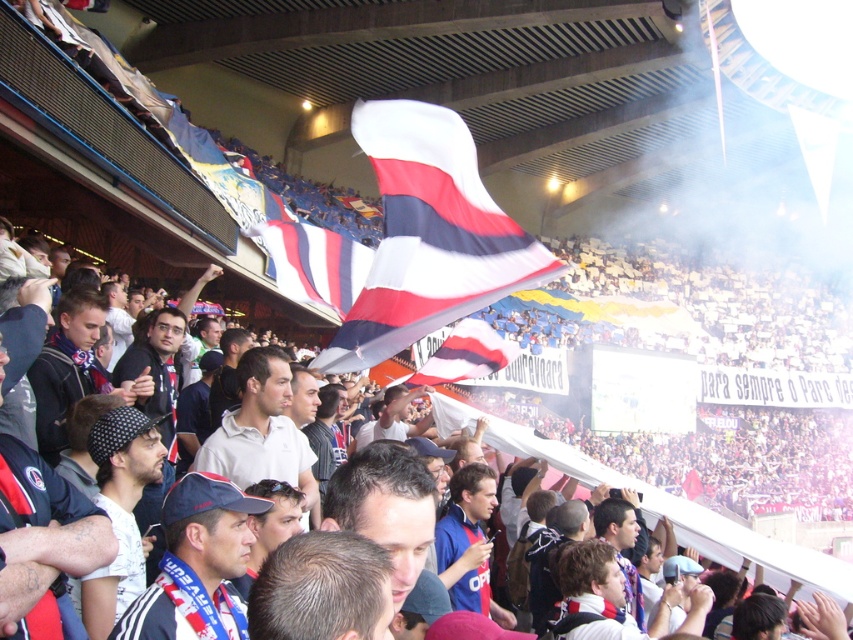
Looking at this image, is dark blue fabric cap at center to the right of white matte shirt at center from the viewer's perspective?

Incorrect, dark blue fabric cap at center is not on the right side of white matte shirt at center.

Is point (245, 556) positioned before point (271, 394)?

Yes, it is in front of point (271, 394).

Identify the location of dark blue fabric cap at center. The width and height of the screenshot is (853, 640). (196, 564).

Locate an element on the screen. dark blue fabric cap at center is located at coordinates (196, 564).

Between point (422, 464) and point (459, 499), which one is positioned in front?

Positioned in front is point (422, 464).

You are a GUI agent. You are given a task and a screenshot of the screen. Output one action in this format:
    pyautogui.click(x=<x>, y=<y>)
    Task: Click on the dark brown hair at center
    
    Given the screenshot: What is the action you would take?
    pyautogui.click(x=386, y=506)

Is blue jersey at center positioned in front of white/red striped flag at center?

Yes, blue jersey at center is in front of white/red striped flag at center.

Who is more forward, (488, 486) or (491, 337)?

Positioned in front is point (488, 486).

Is point (456, 582) behind point (430, 376)?

No, it is in front of (430, 376).

Identify the location of blue jersey at center. (463, 515).